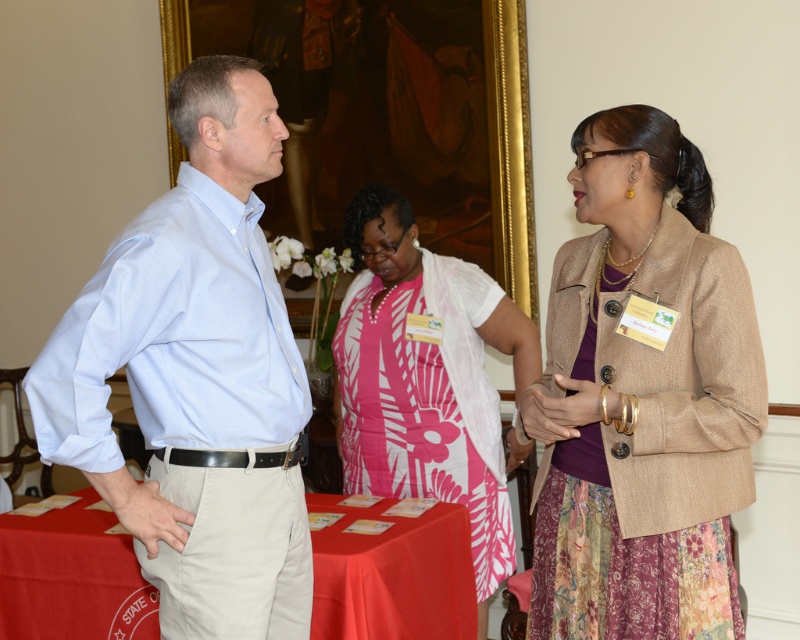
You are a photographer trying to capture a group photo of the light blue shirt at left and the beige textured blazer at right. If your camera has a minimum focus distance of 30 inches, will you be able to take the photo without moving either of them?

The distance between the light blue shirt at left and the beige textured blazer at right is 33.89 inches, which is greater than the camera minimum focus distance of 30 inches. Therefore, you can take the photo without moving them.

Based on the scene description, where exactly is the light blue shirt at left located in the image?

The light blue shirt at left is located at point (x=196, y=376).